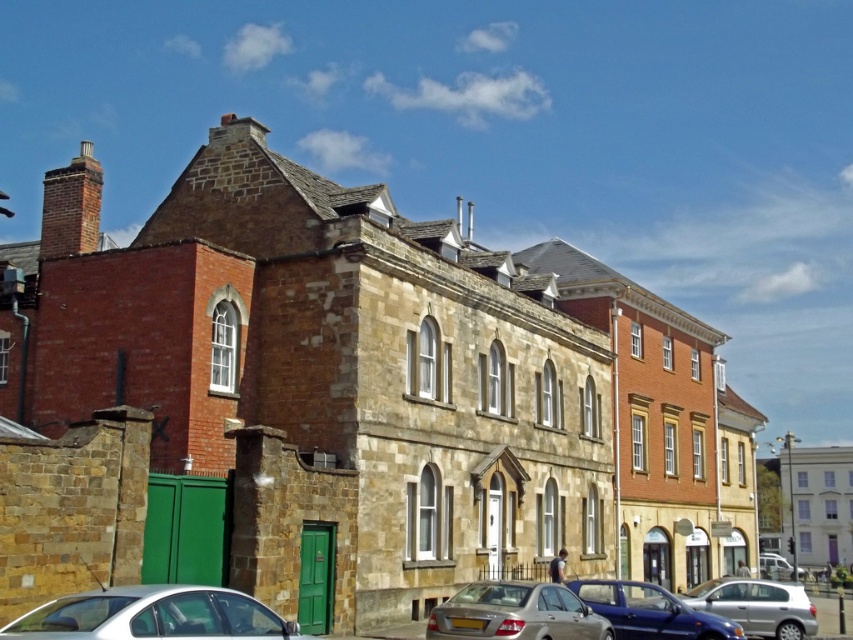
Does silver metallic car at lower left appear over silver metallic hatchback at lower right?

Yes, silver metallic car at lower left is above silver metallic hatchback at lower right.

This screenshot has width=853, height=640. Describe the element at coordinates (154, 616) in the screenshot. I see `silver metallic car at lower left` at that location.

You are a GUI agent. You are given a task and a screenshot of the screen. Output one action in this format:
    pyautogui.click(x=<x>, y=<y>)
    Task: Click on the silver metallic car at lower left
    This screenshot has width=853, height=640.
    Given the screenshot: What is the action you would take?
    pyautogui.click(x=154, y=616)

Is silver metallic car at lower left shorter than satin silver sedan at lower center?

No.

Between silver metallic car at lower left and satin silver sedan at lower center, which one appears on the right side from the viewer's perspective?

satin silver sedan at lower center is more to the right.

Between point (263, 618) and point (505, 595), which one is positioned in front?

Positioned in front is point (263, 618).

Locate an element on the screen. Image resolution: width=853 pixels, height=640 pixels. silver metallic car at lower left is located at coordinates [x=154, y=616].

Is satin silver sedan at lower center thinner than silver metallic hatchback at lower right?

Correct, satin silver sedan at lower center's width is less than silver metallic hatchback at lower right's.

Does point (489, 596) lie behind point (747, 634)?

No, (489, 596) is closer to viewer.

Does point (576, 637) come farther from viewer compared to point (712, 600)?

No, it is not.

Where is `satin silver sedan at lower center`? The height and width of the screenshot is (640, 853). satin silver sedan at lower center is located at coordinates (515, 612).